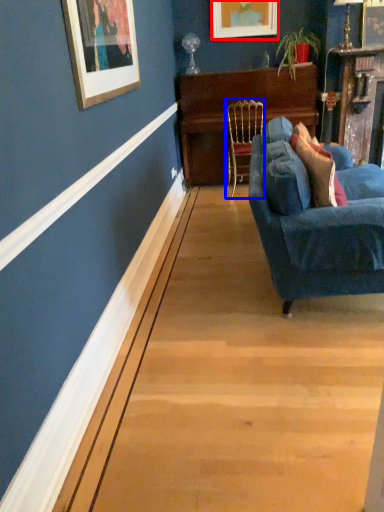
Question: Which object is further to the camera taking this photo, picture frame (highlighted by a red box) or chair (highlighted by a blue box)?

Choices:
 (A) picture frame
 (B) chair

Answer: (A)